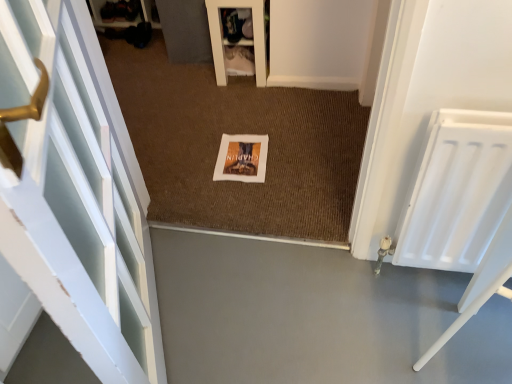
At what (x,y) coordinates should I click in order to perform the action: click on free spot behind white matte picture frame at center. Please return your answer as a coordinate pair (x, y). Looking at the image, I should click on (242, 120).